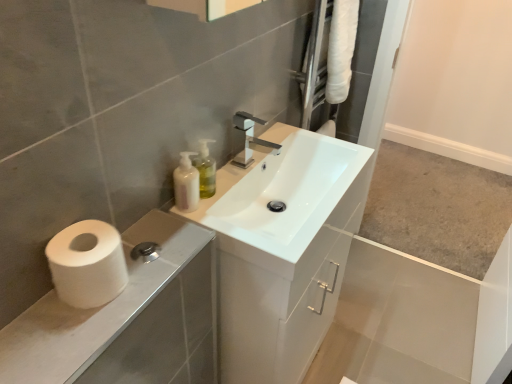
Where is `free spot to the right of white matte toilet paper at lower left`? free spot to the right of white matte toilet paper at lower left is located at coordinates (154, 275).